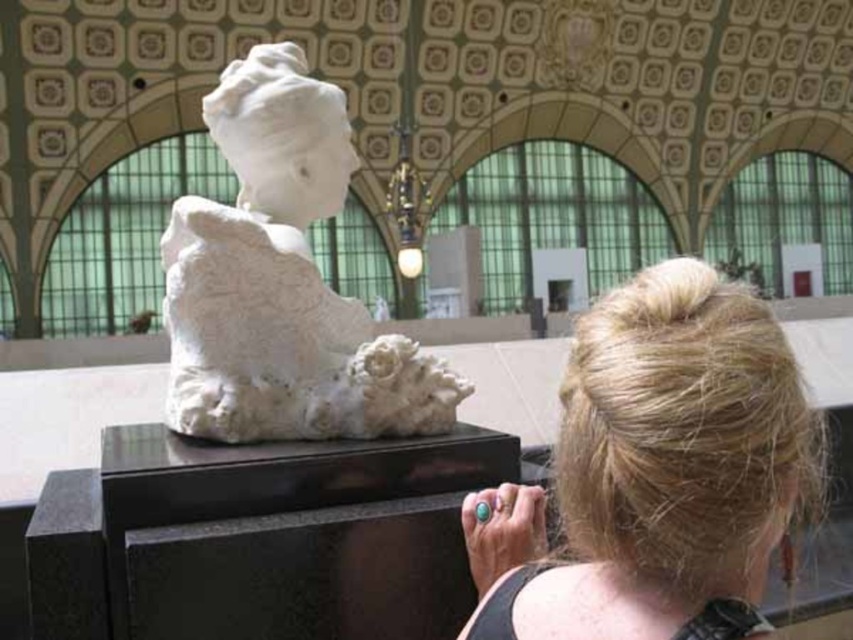
You are standing in the museum and want to take a photo of the sculpture. You notice two points of interest marked on the floor at coordinates point (566, 474) and point (289, 72). Which point should you stand closer to ensure the sculpture is in focus?

You should stand closer to point (566, 474) because it is closer to the viewer, allowing for a clearer focus on the sculpture.

You are an art student observing the white marble sculpture at center and the blonde hair at upper right in the museum. Which object is positioned higher up in the image?

The white marble sculpture at center is positioned higher up than the blonde hair at upper right.

You are an artist observing the scene and want to sketch the blonde hair at upper right and the white marble sculpture at center. Which object should you draw first if you want to start with the larger one?

The blonde hair at upper right is bigger than the white marble sculpture at center, so you should draw the blonde hair at upper right first.